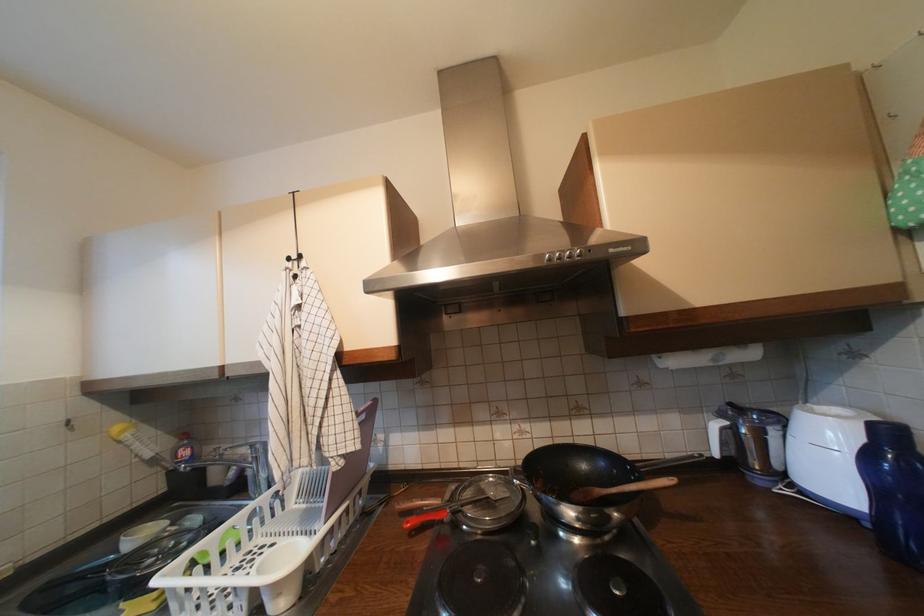
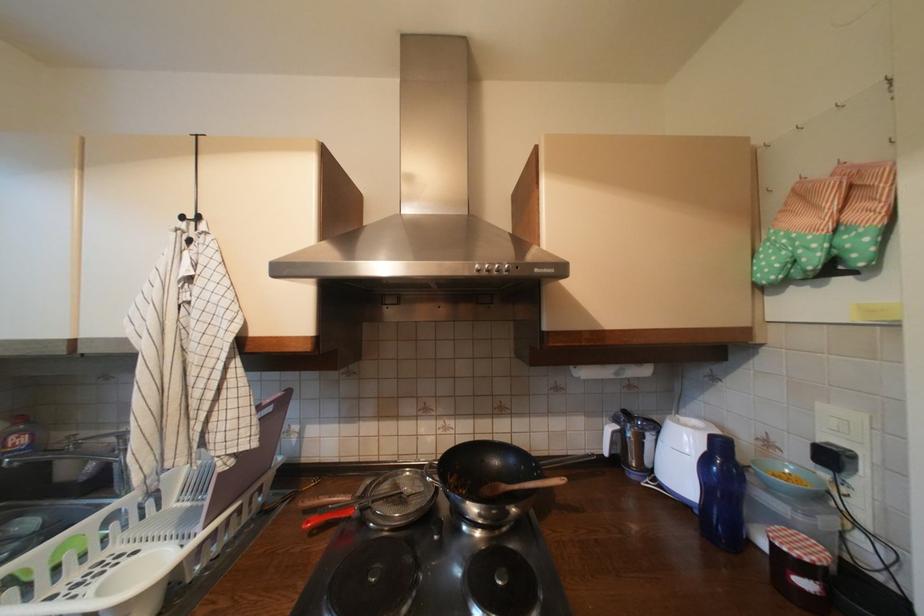
In the second image, find the point that corresponds to point 573,257 in the first image.

(502, 270)